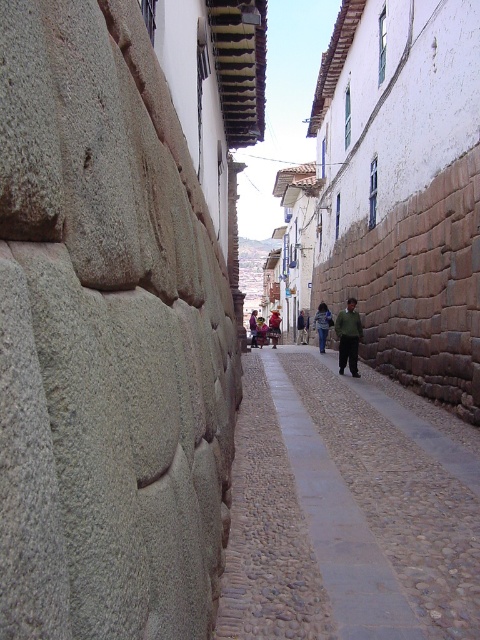
Question: Among these objects, which one is nearest to the camera?

Choices:
 (A) reddish-brown leather jacket at center
 (B) dark green fabric jacket at center
 (C) green fabric jacket at center

Answer: (C)

Question: Among these objects, which one is nearest to the camera?

Choices:
 (A) red fabric dress at center
 (B) smooth cobblestone pavement at center
 (C) green fabric jacket at center

Answer: (B)

Question: Does smooth cobblestone pavement at center come behind blue denim jacket at center?

Choices:
 (A) yes
 (B) no

Answer: (B)

Question: Where is smooth cobblestone pavement at center located in relation to green fabric jacket at center in the image?

Choices:
 (A) right
 (B) left

Answer: (B)

Question: Which is nearer to the blue denim jacket at center?

Choices:
 (A) smooth cobblestone pavement at center
 (B) green fabric jacket at center
 (C) dark green fabric jacket at center

Answer: (B)

Question: Can you confirm if smooth cobblestone pavement at center is positioned to the left of red fabric dress at center?

Choices:
 (A) no
 (B) yes

Answer: (A)